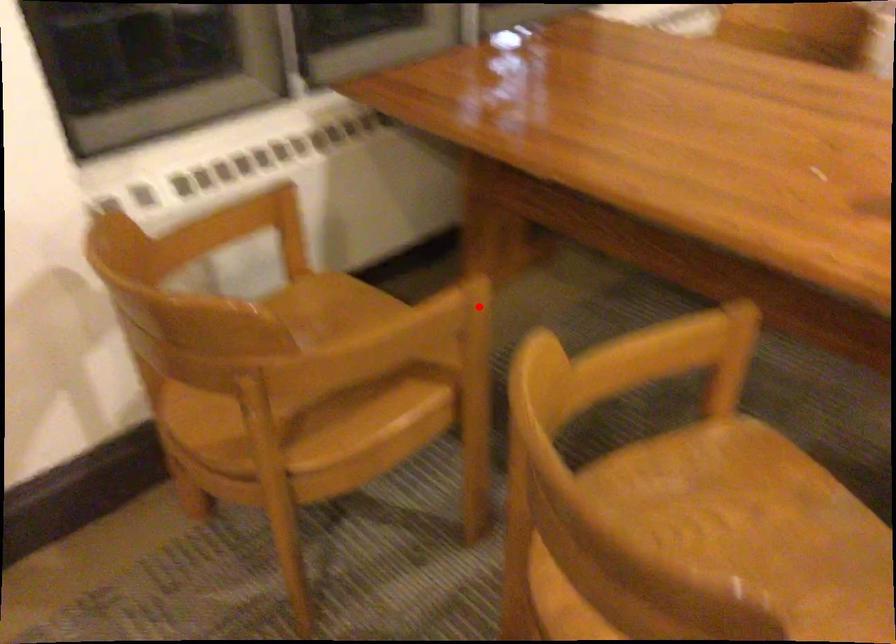
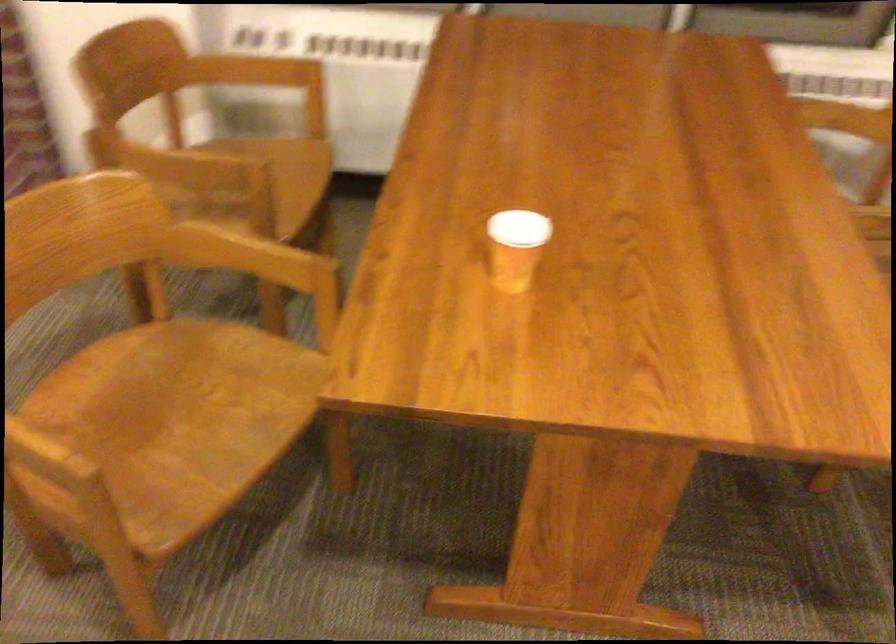
Question: I am providing you with two images of the same scene from different viewpoints. In image1, a red point is highlighted. Considering the same 3D point in image2, which of the following is correct?

Choices:
 (A) It is closer
 (B) It is farther

Answer: (B)